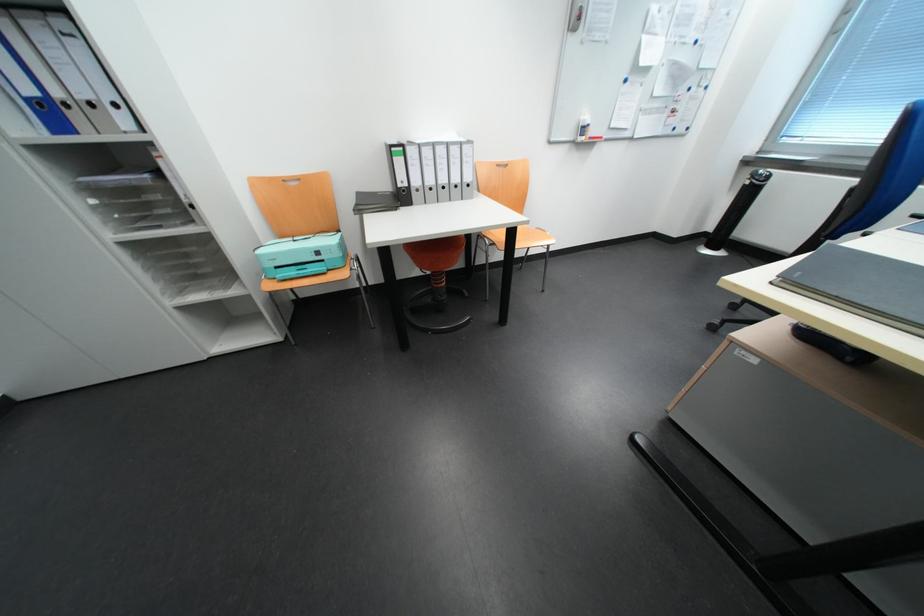
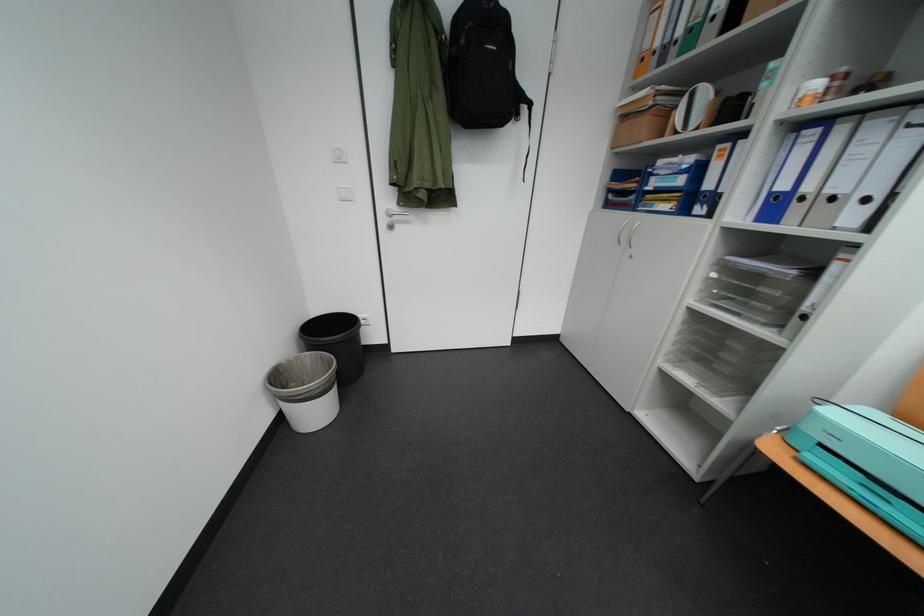
How did the camera likely rotate?

The rotation direction of the camera is left-down.